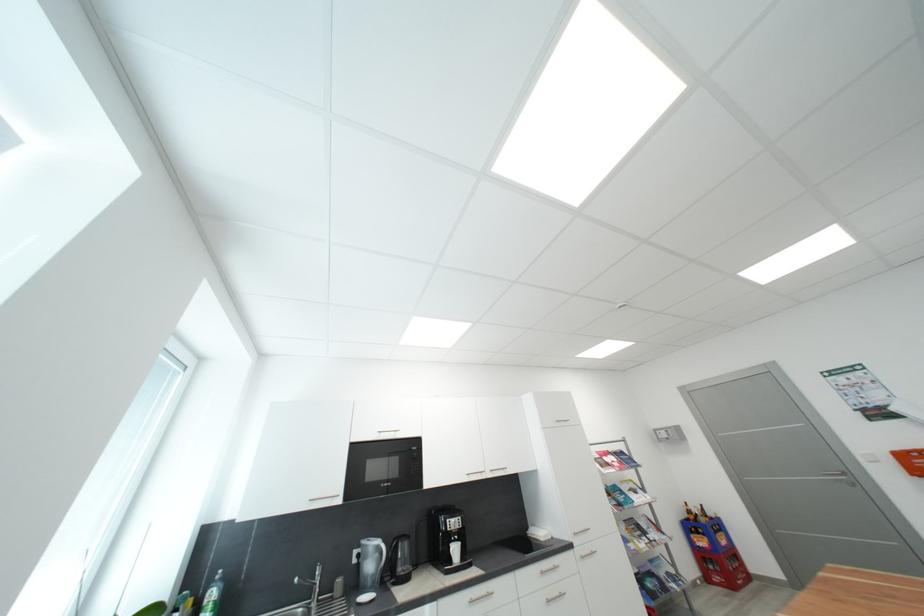
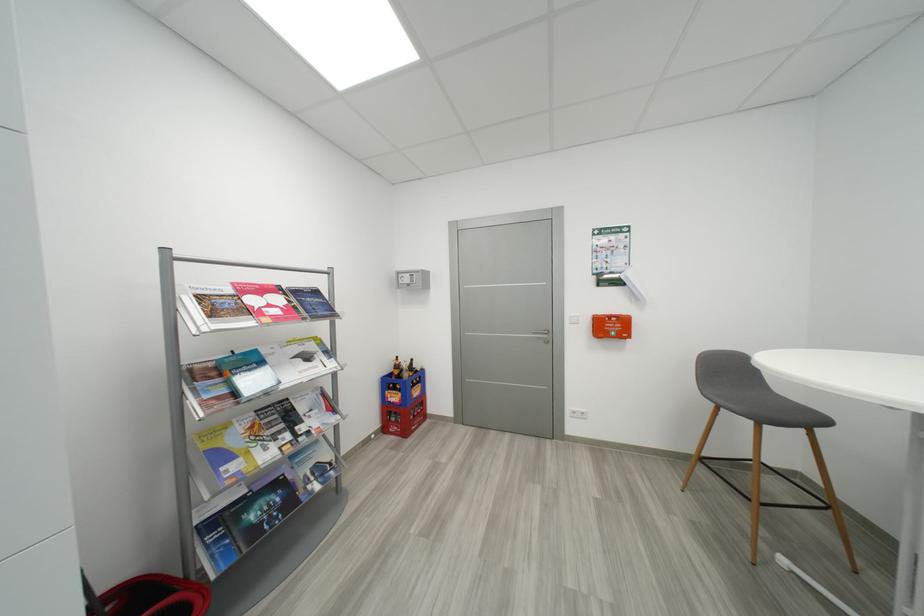
Find the pixel in the second image that matches [714,581] in the first image.

(392, 431)